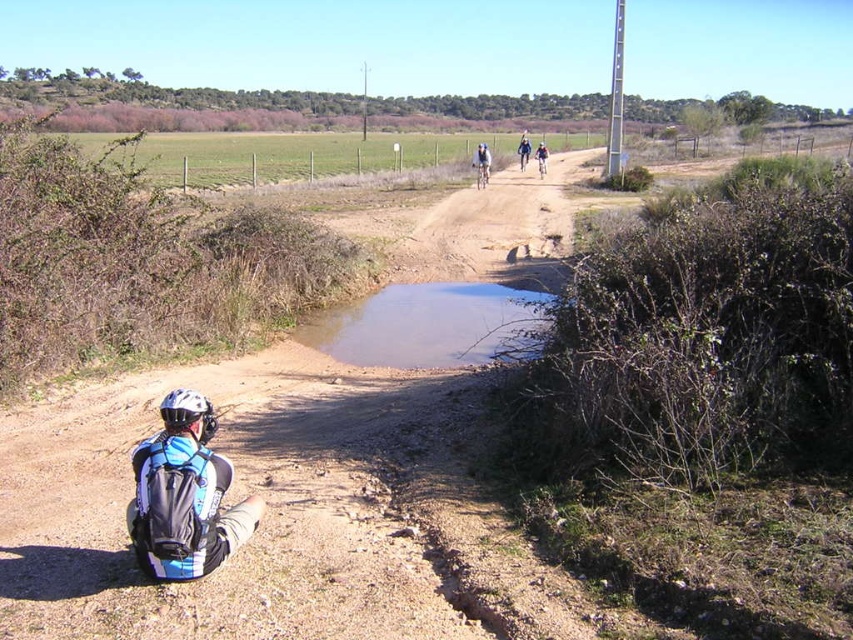
You are a hiker who needs to cross the path. The brown muddy puddle at center is in the middle of the path. Can you step around it without getting your boots dirty? The blue fabric jacket at upper center is on the path as well. Which object is larger and can help you determine where to step?

The blue fabric jacket at upper center is larger than the brown muddy puddle at center. Since the jacket is larger, it might be a better landmark to navigate around the puddle. Step towards the jacket to avoid the muddy area.

You are a hiker who just arrived at this location. You need to place your water bottle on the ground near the brown muddy puddle at center and the white matte bicycle helmet at lower left. Which object should you place it closer to to avoid getting it dirty?

The white matte bicycle helmet at lower left is on the left side of the brown muddy puddle at center, so placing the water bottle closer to the white matte bicycle helmet at lower left would keep it away from the muddy puddle.